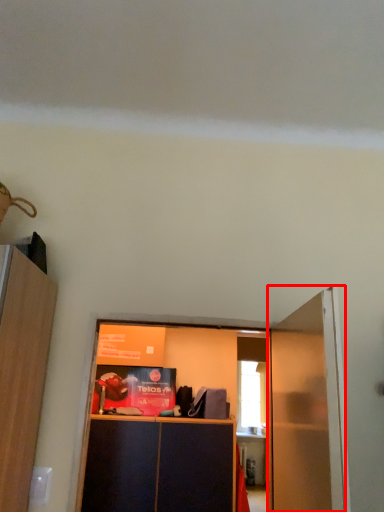
Question: From the image's perspective, what is the correct spatial positioning of door (annotated by the red box) in reference to cabinetry?

Choices:
 (A) below
 (B) above

Answer: (B)